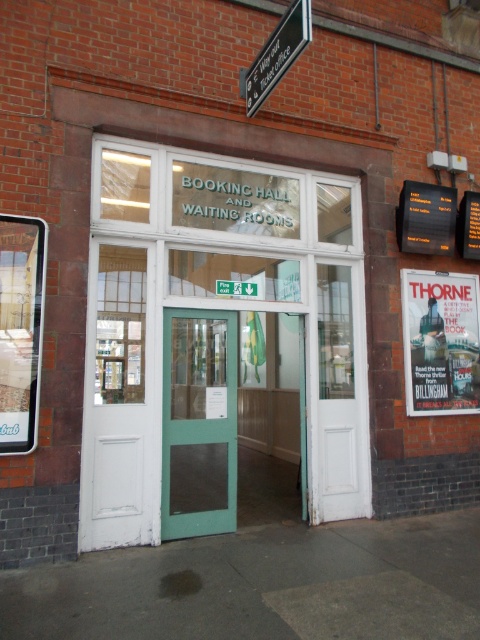
You are a delivery person carrying a package that is 2 meters tall. You arrive at the entrance and see the white wooden door at center and the white wooden door at left. Which door should you use to enter if you need to pass through without tilting the package?

The white wooden door at center is taller than the white wooden door at left, so you should use the white wooden door at center to pass through without tilting the package since it has enough height.

You are a delivery person carrying a package that is 1 meter long. You need to pass through the doors at the entrance. Can you fit through the gap between the white wooden door at center and the white wooden door at left?

The gap between the white wooden door at center and the white wooden door at left is 48.99 centimeters, which is less than 1 meter. Therefore, the package cannot fit through the gap between the white wooden door at center and the white wooden door at left.

You are standing at the entrance of the booking hall and waiting room. You notice two points marked in the scene. Which point, point 1 at coordinates (231, 396) or point 2 at coordinates (278, 22), is closer to you?

Point 1 at coordinates (231, 396) is closer to the viewer than point 2 at coordinates (278, 22).